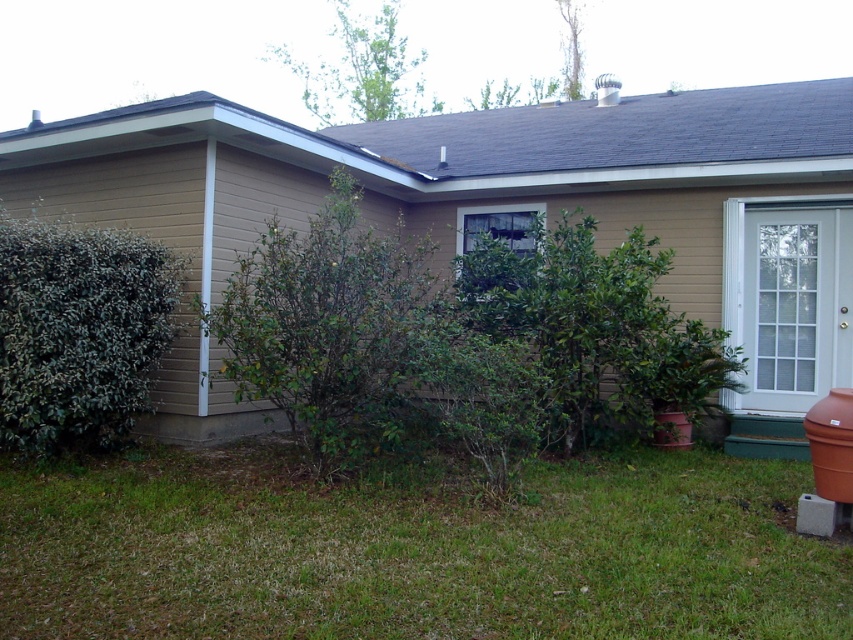
You are standing in front of the house and want to place a new potted plant exactly where the green leafy bush at center is currently located. Based on the scene description, can you confirm if there is enough space to place the potted plant at that exact position?

The green leafy bush at center is located at point (329,326), so there is enough space to place the potted plant at that exact position since the coordinates indicate an available spot.

You are standing in front of the house and want to place a 2.5 meters long garden hose from the green grass at lower center to the green leafy bush at center. Will the hose reach the bush without bending?

The distance between the green grass at lower center and the green leafy bush at center is 2.17 meters, which is shorter than the 2.5 meters length of the hose. Therefore, the hose will reach the bush without bending and will have extra length remaining.